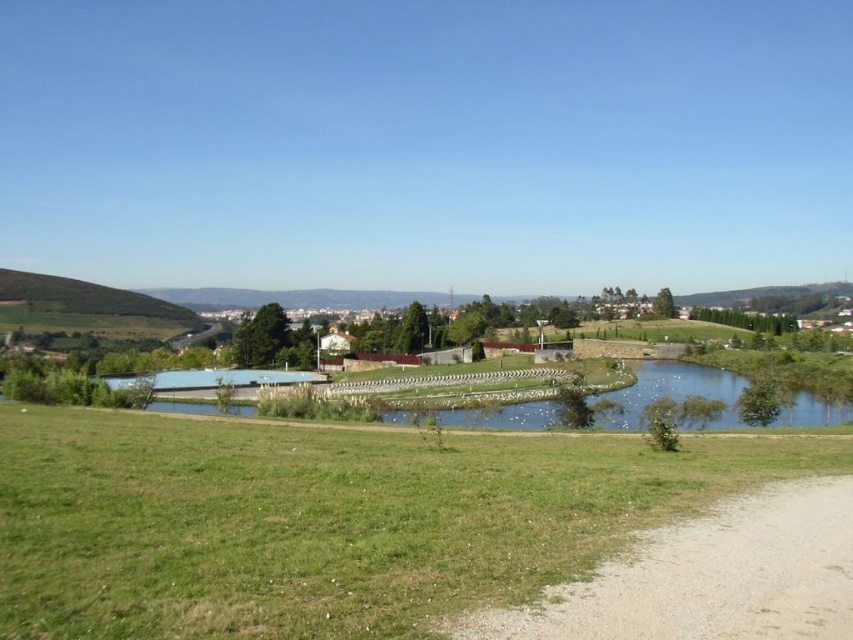
Question: In this image, where is green grassy field at lower center located relative to green grassy hill at left?

Choices:
 (A) right
 (B) left

Answer: (A)

Question: Which point is closer to the camera?

Choices:
 (A) gravelly dirt path at lower right
 (B) green grassy field at lower center

Answer: (B)

Question: Is green grassy field at lower center below gravelly dirt path at lower right?

Choices:
 (A) yes
 (B) no

Answer: (A)

Question: Is green grassy field at lower center below green grassy hill at left?

Choices:
 (A) no
 (B) yes

Answer: (B)

Question: Among these points, which one is farthest from the camera?

Choices:
 (A) (663, 609)
 (B) (421, 445)

Answer: (B)

Question: Which point is farther from the camera taking this photo?

Choices:
 (A) (x=788, y=572)
 (B) (x=281, y=609)

Answer: (A)